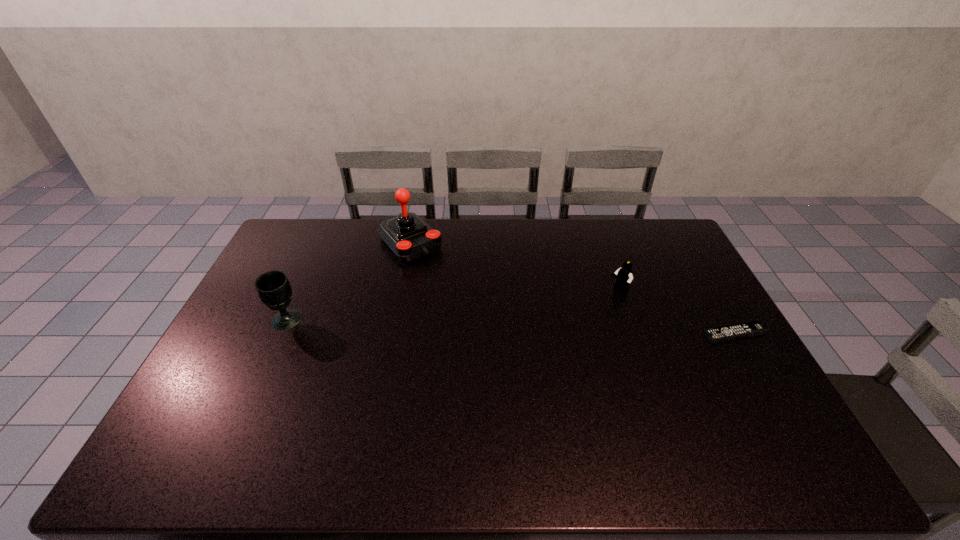
Locate an element on the screen. The image size is (960, 540). vacant space located on the front-facing side of the Lego is located at coordinates (602, 301).

At what (x,y) coordinates should I click in order to perform the action: click on vacant space located on the front-facing side of the Lego. Please return your answer as a coordinate pair (x, y). Image resolution: width=960 pixels, height=540 pixels. Looking at the image, I should click on (530, 345).

I want to click on free location located 0.300m on the front-facing side of the Lego, so click(545, 335).

This screenshot has height=540, width=960. I want to click on vacant region located 0.150m on the base of the joystick, so click(447, 283).

Where is `free space located 0.380m on the base of the joystick`? free space located 0.380m on the base of the joystick is located at coordinates (486, 324).

Locate an element on the screen. This screenshot has height=540, width=960. vacant space located 0.170m on the base of the joystick is located at coordinates (450, 286).

This screenshot has height=540, width=960. Find the location of `object that is at the far edge`. object that is at the far edge is located at coordinates (407, 235).

I want to click on object present at the left edge, so click(x=273, y=287).

Find the location of a particular element. object at the right edge is located at coordinates (753, 328).

The width and height of the screenshot is (960, 540). Identify the location of free space at the far edge of the desktop. (642, 255).